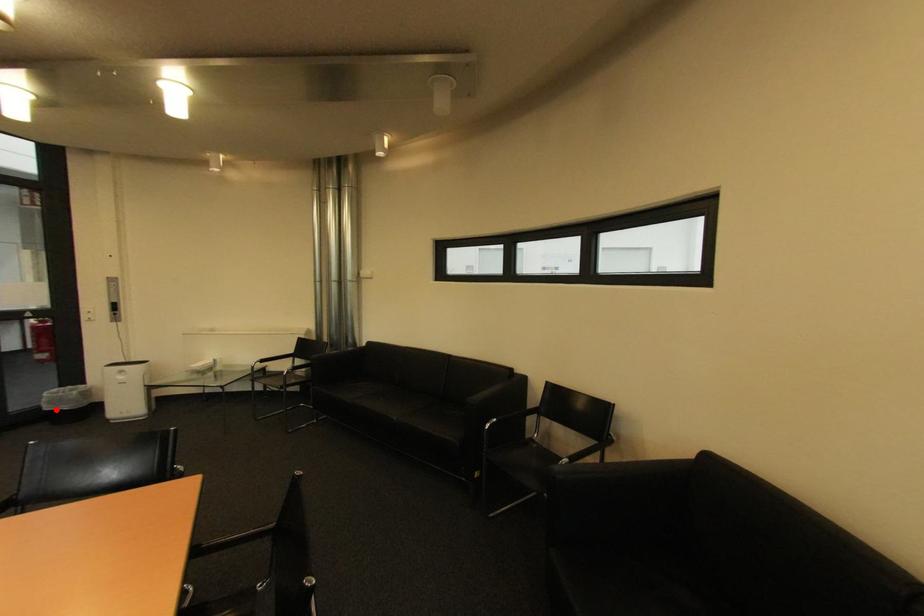
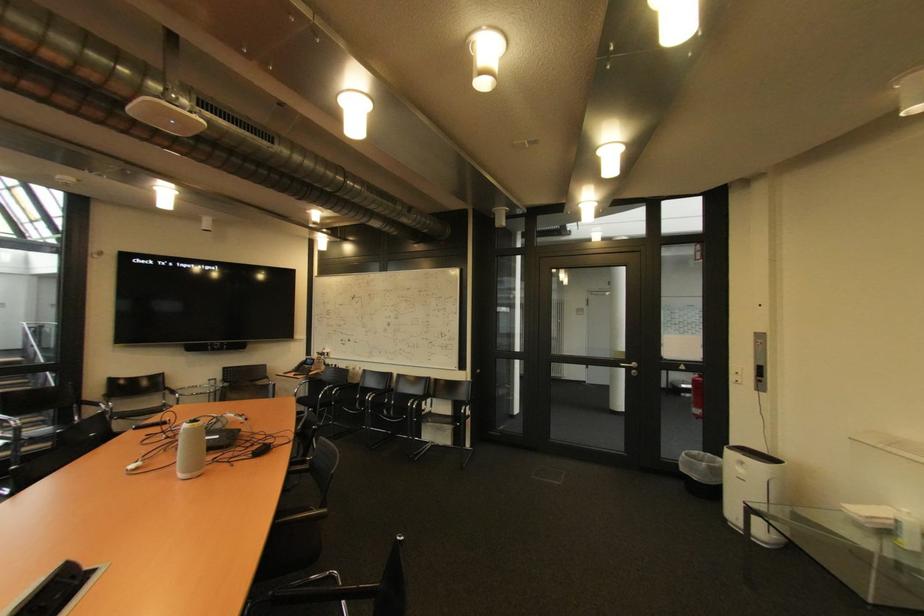
Question: A red point is marked in image1. In image2, is the corresponding 3D point closer to the camera or farther? Reply with the corresponding letter.

Choices:
 (A) The corresponding 3D point is closer.
 (B) The corresponding 3D point is farther.

Answer: (A)